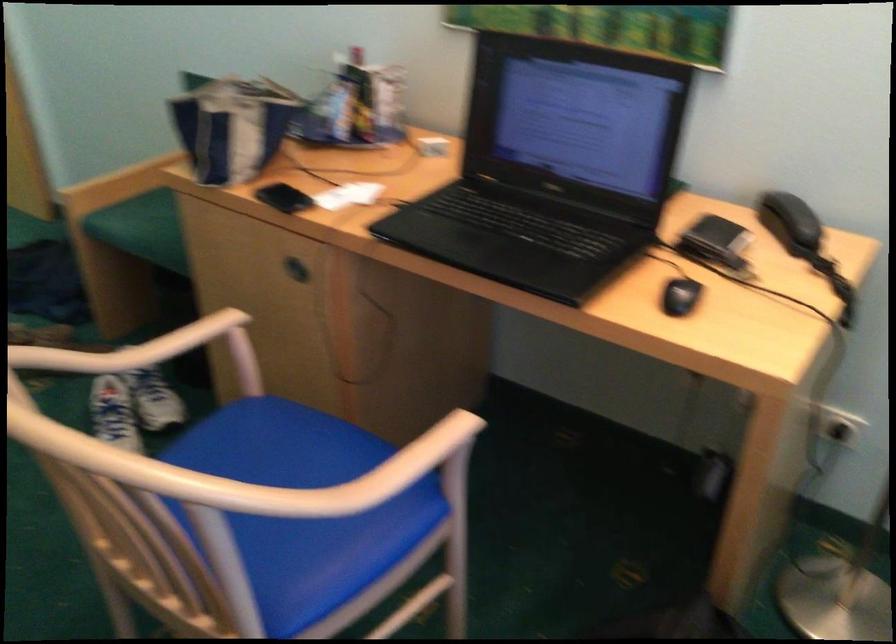
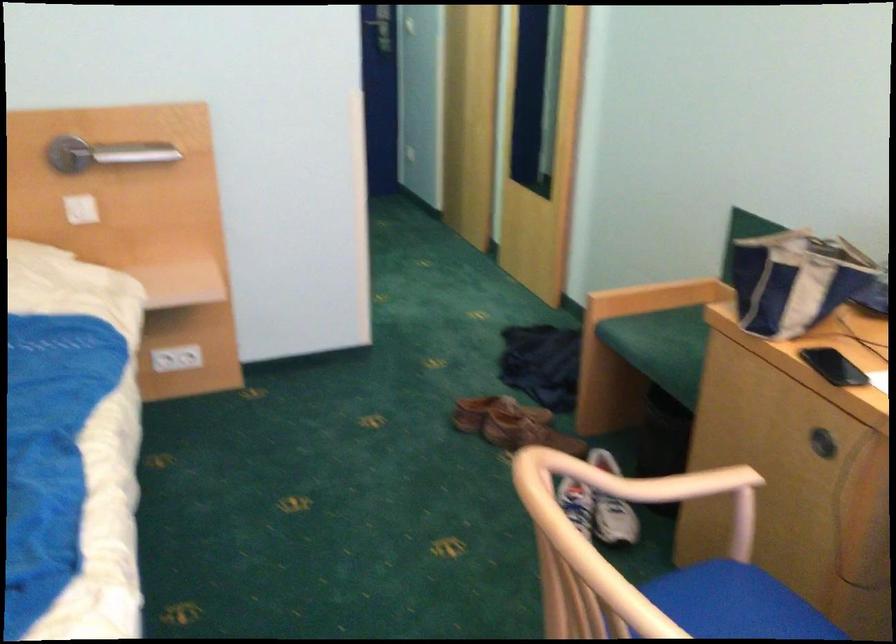
Where in the second image is the point corresponding to point (156, 234) from the first image?

(661, 346)